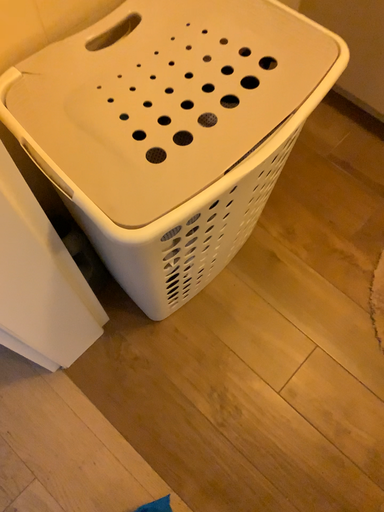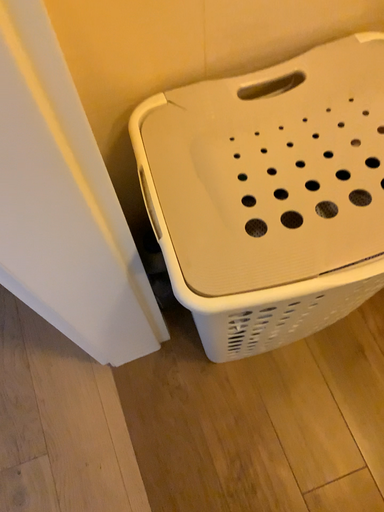
Question: How did the camera likely rotate when shooting the video?

Choices:
 (A) rotated right
 (B) rotated left

Answer: (B)